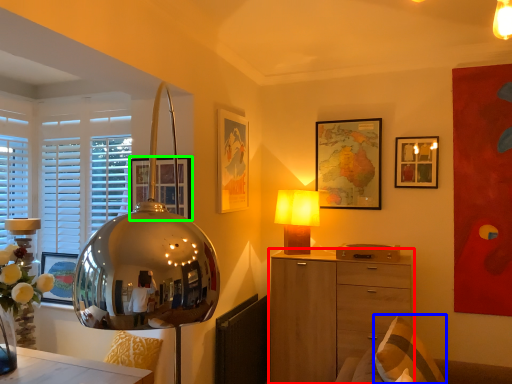
Question: Estimate the real-world distances between objects in this image. Which object is closer to chest of drawers (highlighted by a red box), pillow (highlighted by a blue box) or picture frame (highlighted by a green box)?

Choices:
 (A) pillow
 (B) picture frame

Answer: (A)